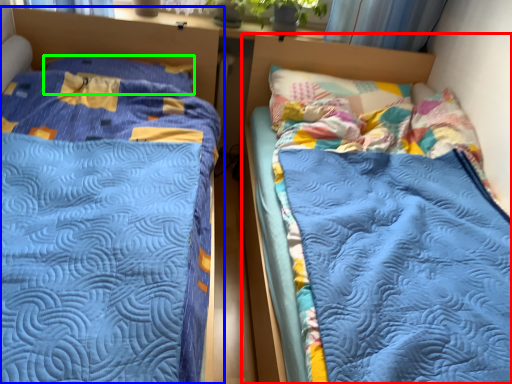
Question: Considering the real-world distances, which object is farthest from bed (highlighted by a red box)? bed (highlighted by a blue box) or pillow (highlighted by a green box)?

Choices:
 (A) bed
 (B) pillow

Answer: (A)